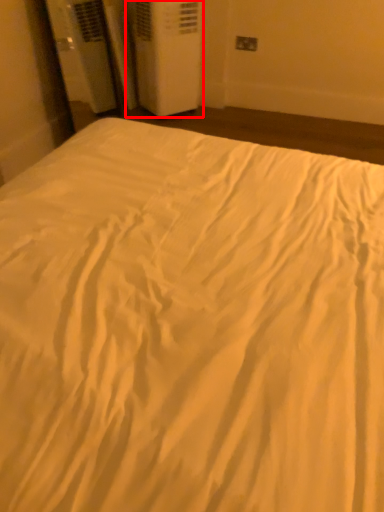
Question: Observing the image, what is the correct spatial positioning of air conditioning (annotated by the red box) in reference to electric outlet?

Choices:
 (A) left
 (B) right

Answer: (A)